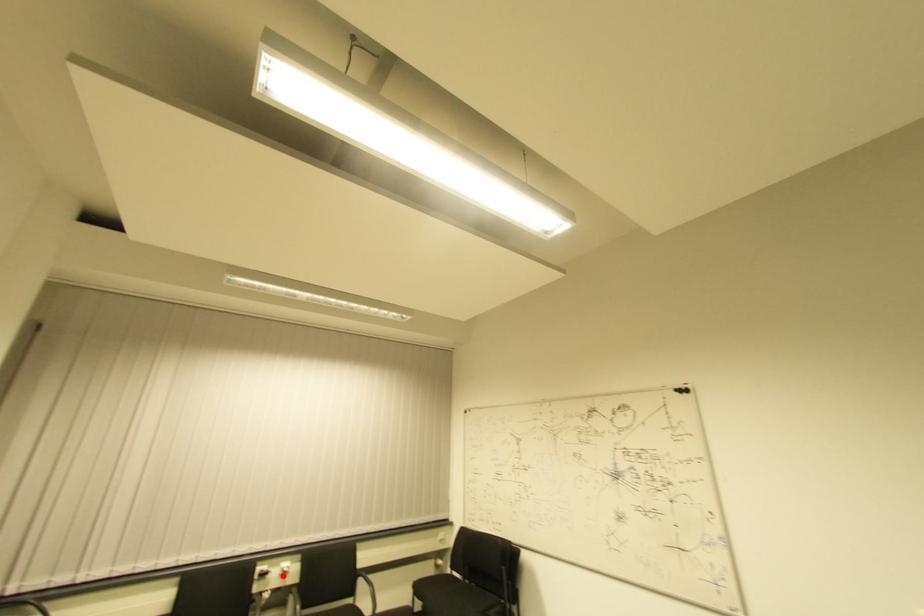
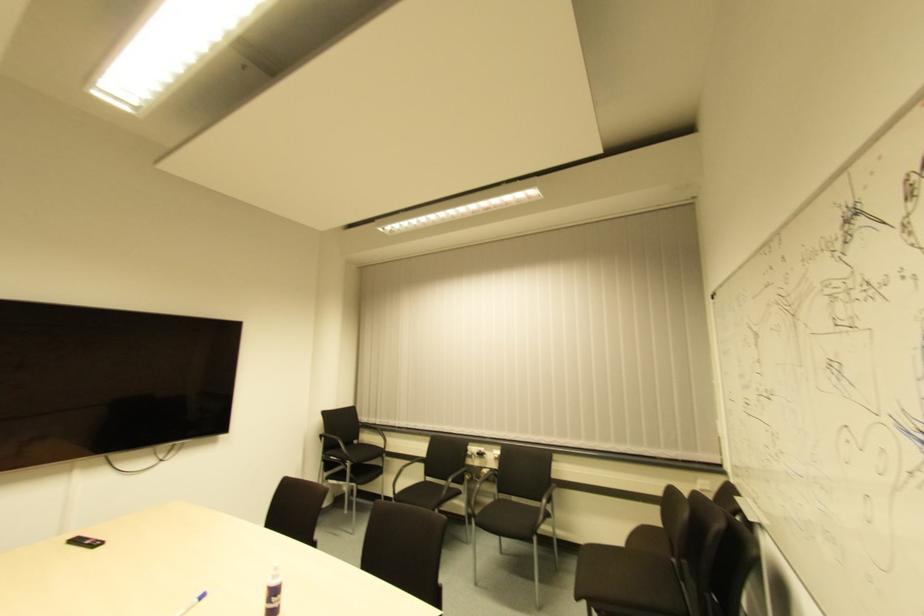
Find the pixel in the second image that matches the highlighted location in the first image.

(494, 462)